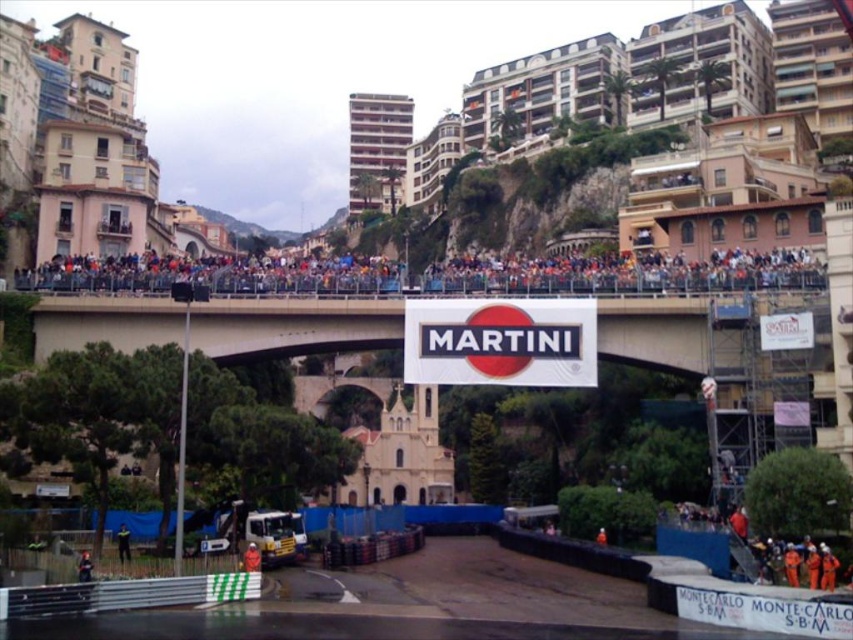
You are a race official at the Monaco Grand Prix. You need to place a new banner exactly where the white matte sign at center is located. What are the coordinates where you should place the banner?

The white matte sign at center is located at coordinates point (500, 340), so you should place the new banner there.

You are a spectator at the Monaco Grand Prix. You want to take a photo of the white matte sign at center but also want the orange fabric person at center to be visible in the shot. Is this possible?

The orange fabric person at center is behind the white matte sign at center, so if you position yourself so that the orange fabric person at center is not completely obscured by the white matte sign at center, you can capture both in the photo.

You are a photographer standing at the starting line of the race. You want to take a photo that includes both the white concrete bridge at center and the green fabric jacket at lower left. Which object will appear larger in the photo?

The white concrete bridge at center will appear larger in the photo because it is much taller than the green fabric jacket at lower left.